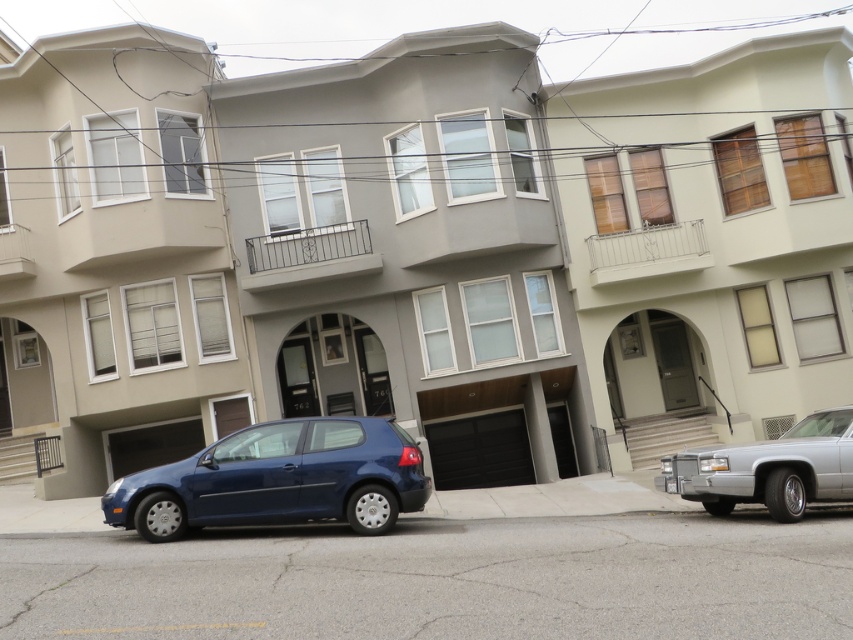
Question: Which point is farther to the camera?

Choices:
 (A) matte blue hatchback at center
 (B) silver metallic sedan at right

Answer: (B)

Question: Can you confirm if matte blue hatchback at center is positioned to the right of silver metallic sedan at right?

Choices:
 (A) yes
 (B) no

Answer: (B)

Question: Which point is farther from the camera taking this photo?

Choices:
 (A) (294, 522)
 (B) (811, 454)

Answer: (B)

Question: From the image, what is the correct spatial relationship of matte blue hatchback at center in relation to silver metallic sedan at right?

Choices:
 (A) below
 (B) above

Answer: (A)

Question: Does matte blue hatchback at center have a greater width compared to silver metallic sedan at right?

Choices:
 (A) yes
 (B) no

Answer: (A)

Question: Which point appears closest to the camera in this image?

Choices:
 (A) (125, 486)
 (B) (706, 509)

Answer: (A)